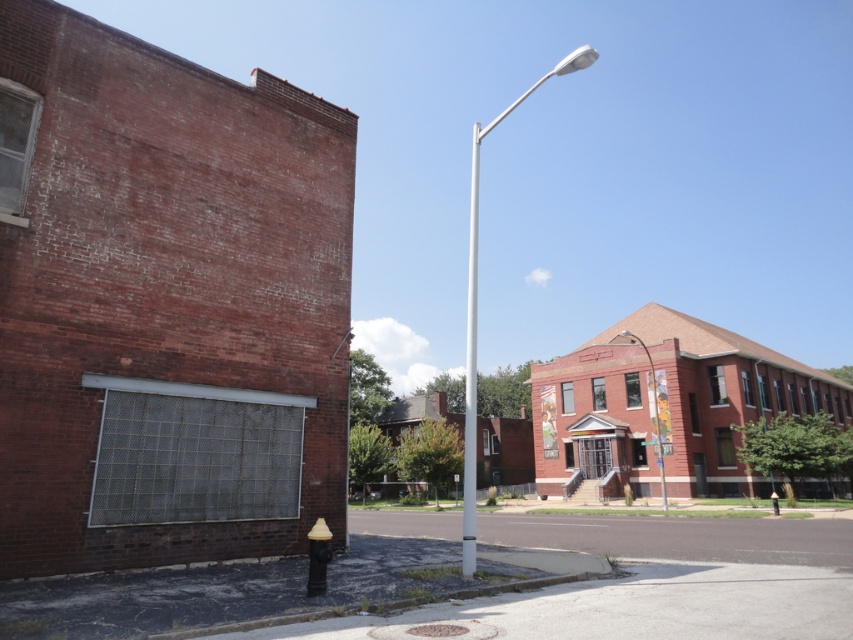
Can you confirm if white metallic pole at center is positioned above metallic streetlight at center?

Correct, white metallic pole at center is located above metallic streetlight at center.

Is white metallic pole at center to the right of metallic streetlight at center from the viewer's perspective?

Incorrect, white metallic pole at center is not on the right side of metallic streetlight at center.

Is point (474, 445) positioned behind point (654, 396)?

No, it is not.

Locate an element on the screen. Image resolution: width=853 pixels, height=640 pixels. white metallic pole at center is located at coordinates (476, 307).

This screenshot has height=640, width=853. What do you see at coordinates (471, 369) in the screenshot?
I see `silver metallic pole at center` at bounding box center [471, 369].

Between point (469, 177) and point (648, 355), which one is positioned behind?

The point (469, 177) is more distant.

At what (x,y) coordinates should I click in order to perform the action: click on silver metallic pole at center. Please return your answer as a coordinate pair (x, y). This screenshot has width=853, height=640. Looking at the image, I should click on (471, 369).

Which is in front, point (474, 260) or point (463, 438)?

Point (463, 438)

Is white metallic pole at center behind silver metallic pole at center?

Yes, white metallic pole at center is behind silver metallic pole at center.

What do you see at coordinates (476, 307) in the screenshot? I see `white metallic pole at center` at bounding box center [476, 307].

I want to click on white metallic pole at center, so pyautogui.click(x=476, y=307).